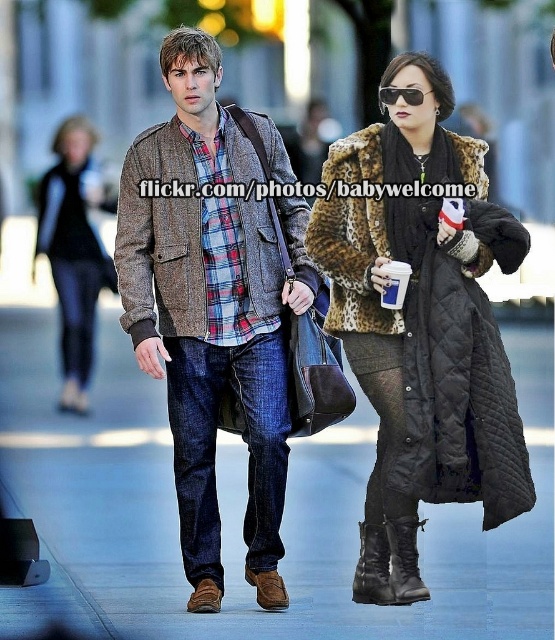
Question: Does black leather boot at lower right come behind black reflective sunglasses at upper center?

Choices:
 (A) yes
 (B) no

Answer: (B)

Question: Observing the image, what is the correct spatial positioning of plaid cotton shirt at center in reference to black reflective sunglasses at upper center?

Choices:
 (A) above
 (B) below

Answer: (B)

Question: Which of the following is the farthest from the observer?

Choices:
 (A) black leather boot at lower center
 (B) plaid cotton shirt at center

Answer: (B)

Question: Which point appears closest to the camera in this image?

Choices:
 (A) (406, 86)
 (B) (365, 237)
 (C) (198, 136)
 (D) (380, 554)

Answer: (D)

Question: Which point is farther from the camera taking this photo?

Choices:
 (A) (360, 524)
 (B) (421, 102)

Answer: (B)

Question: In this image, where is black leather boot at lower center located relative to black reflective sunglasses at upper center?

Choices:
 (A) below
 (B) above

Answer: (A)